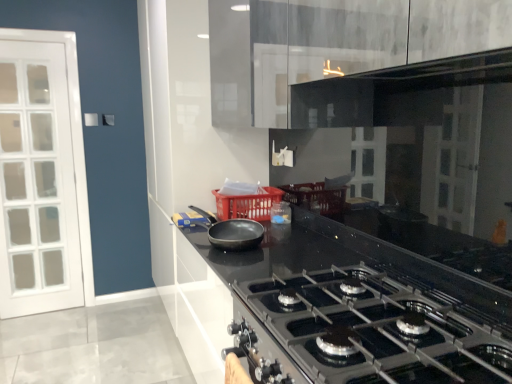
Question: Considering the relative sizes of translucent plastic container at center and red plastic basket at center in the image provided, is translucent plastic container at center shorter than red plastic basket at center?

Choices:
 (A) no
 (B) yes

Answer: (B)

Question: Considering the relative sizes of translucent plastic container at center and red plastic basket at center in the image provided, is translucent plastic container at center wider than red plastic basket at center?

Choices:
 (A) no
 (B) yes

Answer: (A)

Question: Is translucent plastic container at center further to camera compared to red plastic basket at center?

Choices:
 (A) no
 (B) yes

Answer: (B)

Question: From the image's perspective, is translucent plastic container at center located above red plastic basket at center?

Choices:
 (A) no
 (B) yes

Answer: (A)

Question: Is red plastic basket at center inside translucent plastic container at center?

Choices:
 (A) no
 (B) yes

Answer: (A)

Question: Could you tell me if translucent plastic container at center is facing red plastic basket at center?

Choices:
 (A) yes
 (B) no

Answer: (B)

Question: Would you say red plastic basket at center contains black glossy countertop at center?

Choices:
 (A) no
 (B) yes

Answer: (A)

Question: Is red plastic basket at center aimed at black glossy countertop at center?

Choices:
 (A) yes
 (B) no

Answer: (B)

Question: Is red plastic basket at center positioned beyond the bounds of black glossy countertop at center?

Choices:
 (A) no
 (B) yes

Answer: (B)

Question: Does red plastic basket at center have a smaller size compared to black glossy countertop at center?

Choices:
 (A) yes
 (B) no

Answer: (A)

Question: Is red plastic basket at center oriented away from black glossy countertop at center?

Choices:
 (A) yes
 (B) no

Answer: (B)

Question: Can you confirm if red plastic basket at center is positioned to the right of black glossy countertop at center?

Choices:
 (A) no
 (B) yes

Answer: (A)

Question: Would you say matte black pan at center is a long distance from translucent plastic container at center?

Choices:
 (A) no
 (B) yes

Answer: (A)